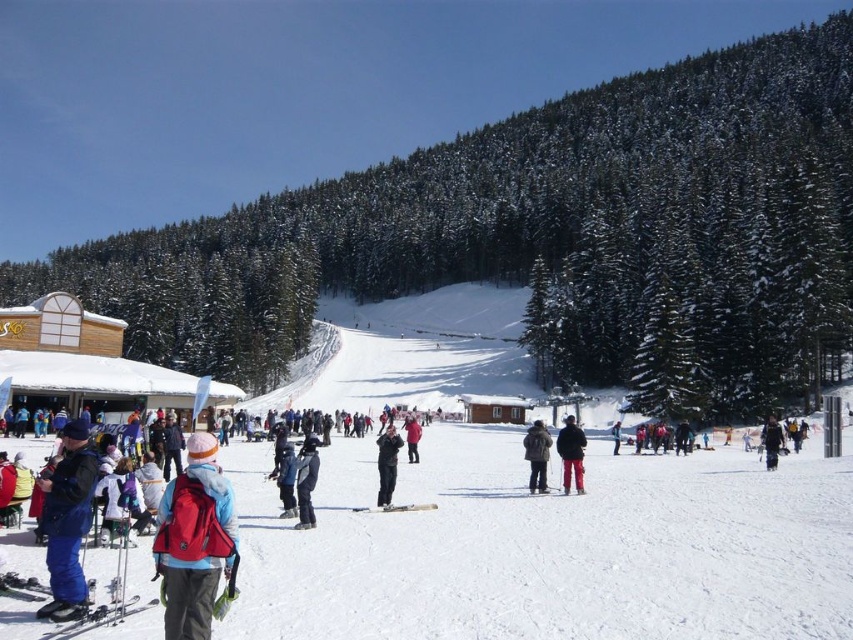
You are a photographer trying to capture the matte blue ski at lower left and the matte black jacket at center in the same frame. Can you see both objects clearly without moving your camera position?

The matte blue ski at lower left is positioned over matte black jacket at center, so the ski may block part of the jacket, making it harder to see both clearly in the same frame.

You are a photographer trying to capture both the red pants at center and the dark gray jacket at center in a single frame. Given that your camera has a fixed focal length, which object should you focus on to ensure both are in focus, considering their sizes?

Since the red pants at center is larger in size compared to the dark gray jacket at center, you should focus on the red pants at center to ensure both are in focus.